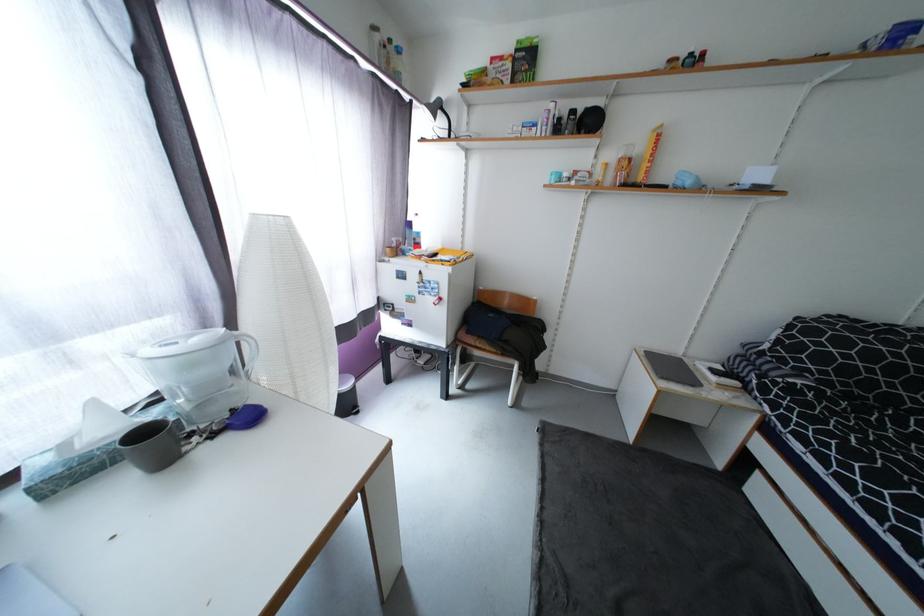
Find the location of a particular element. This screenshot has height=616, width=924. Prince cereal box is located at coordinates (423, 297).